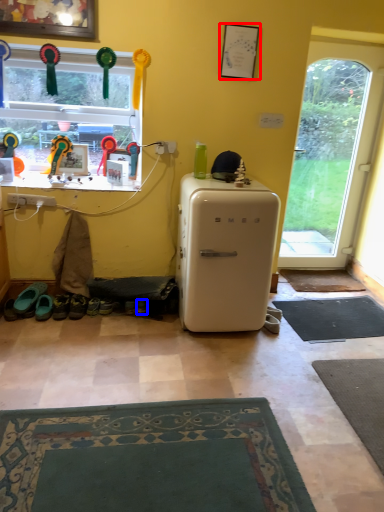
Question: Among these objects, which one is nearest to the camera, picture frame (highlighted by a red box) or shoe (highlighted by a blue box)?

Choices:
 (A) picture frame
 (B) shoe

Answer: (A)